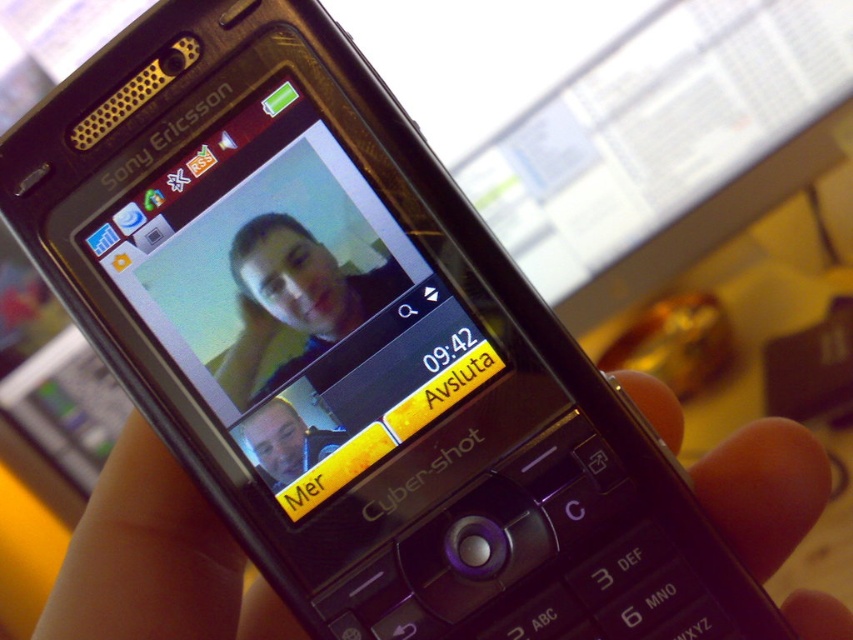
Who is taller, matte black phone at center or matte black face at center?

matte black phone at center

Is point (242, 372) more distant than point (277, 432)?

That is True.

Describe the element at coordinates (293, 300) in the screenshot. I see `matte black phone at center` at that location.

Where is `matte black phone at center`? The height and width of the screenshot is (640, 853). matte black phone at center is located at coordinates point(293,300).

Does point (813, 444) lie in front of point (273, 289)?

No, it is behind (273, 289).

Between point (149, 563) and point (309, 349), which one is positioned behind?

Point (149, 563)

Does point (160, 561) lie in front of point (308, 282)?

No, it is behind (308, 282).

Find the location of a particular element. black matte hand at center is located at coordinates (155, 561).

Between black matte hand at center and matte black face at center, which one has more height?

With more height is black matte hand at center.

Is black matte hand at center shorter than matte black face at center?

In fact, black matte hand at center may be taller than matte black face at center.

What do you see at coordinates (155, 561) in the screenshot? The image size is (853, 640). I see `black matte hand at center` at bounding box center [155, 561].

Find the location of a particular element. black matte hand at center is located at coordinates (155, 561).